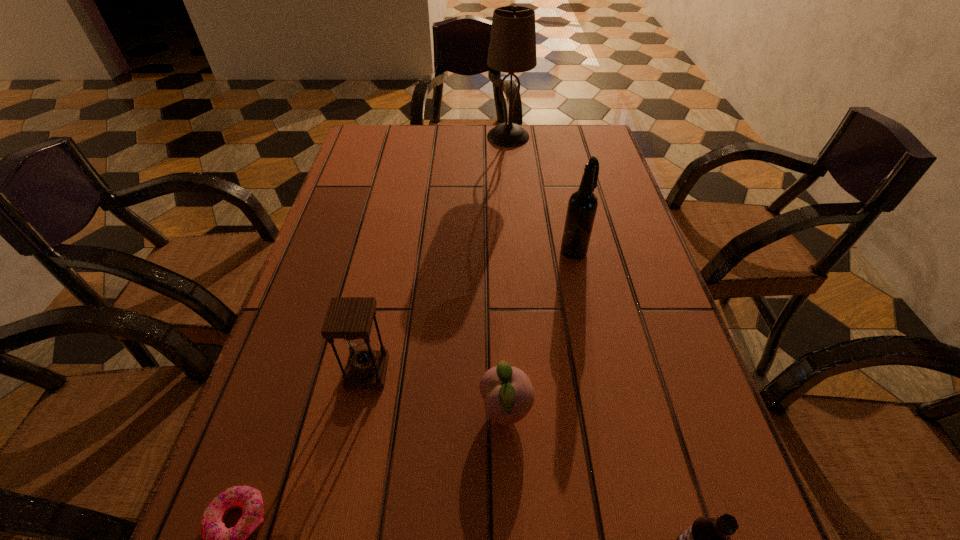
At what (x,y) coordinates should I click in order to perform the action: click on unoccupied position between the beer bottle and the second shortest object. Please return your answer as a coordinate pair (x, y). This screenshot has width=960, height=540. Looking at the image, I should click on (540, 329).

Locate an element on the screen. free area in between the fifth object from right to left and the tallest object is located at coordinates (438, 254).

Find the location of a particular element. The height and width of the screenshot is (540, 960). vacant area that lies between the lampshade and the second shortest object is located at coordinates (507, 273).

The height and width of the screenshot is (540, 960). Identify the location of free space between the second farthest object and the farthest object. (540, 193).

You are a GUI agent. You are given a task and a screenshot of the screen. Output one action in this format:
    pyautogui.click(x=<x>, y=<y>)
    Task: Click on the vacant space that's between the hourglass and the second farthest object
    Image resolution: width=960 pixels, height=540 pixels.
    Given the screenshot: What is the action you would take?
    pyautogui.click(x=470, y=310)

You are a GUI agent. You are given a task and a screenshot of the screen. Output one action in this format:
    pyautogui.click(x=<x>, y=<y>)
    Task: Click on the free space between the lampshade and the fifth shortest object
    Image resolution: width=960 pixels, height=540 pixels.
    Given the screenshot: What is the action you would take?
    pyautogui.click(x=540, y=193)

Identify the location of empty space between the fifth tallest object and the beer bottle. (540, 329).

This screenshot has width=960, height=540. In order to click on the fourth closest object to the second tallest object in this screenshot , I will do `click(708, 539)`.

Identify the location of object identified as the fourth closest to the second farthest object. (708, 539).

Identify the location of free spot that satisfies the following two spatial constraints: 1. on the front-facing side of the lampshade; 2. on the front side of the hourglass. (529, 372).